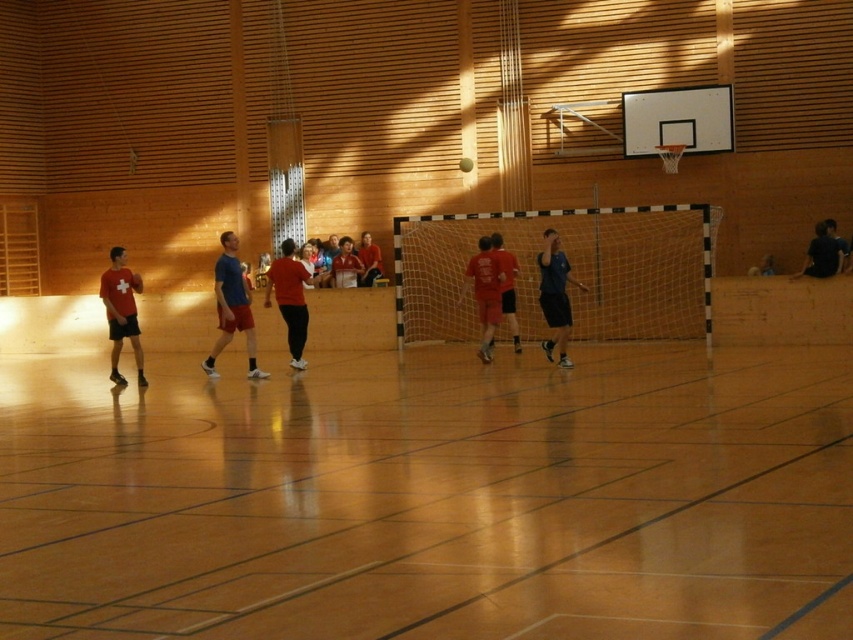
Question: Which of the following is the farthest from the observer?

Choices:
 (A) (368, 282)
 (B) (548, 307)
 (C) (297, 348)

Answer: (A)

Question: Which object is farther from the camera taking this photo?

Choices:
 (A) matte red shirt at center
 (B) matte red shirts at center

Answer: (B)

Question: Which is nearer to the blue fabric shirt at center?

Choices:
 (A) matte red shirt at center
 (B) matte red shirt at left

Answer: (A)

Question: Does matte red shirt at left appear over matte red shirts at center?

Choices:
 (A) yes
 (B) no

Answer: (B)

Question: Is the position of matte red shirt at center less distant than that of matte red shirts at center?

Choices:
 (A) yes
 (B) no

Answer: (A)

Question: Is matte blue shorts at center thinner than matte red shirt at center?

Choices:
 (A) yes
 (B) no

Answer: (B)